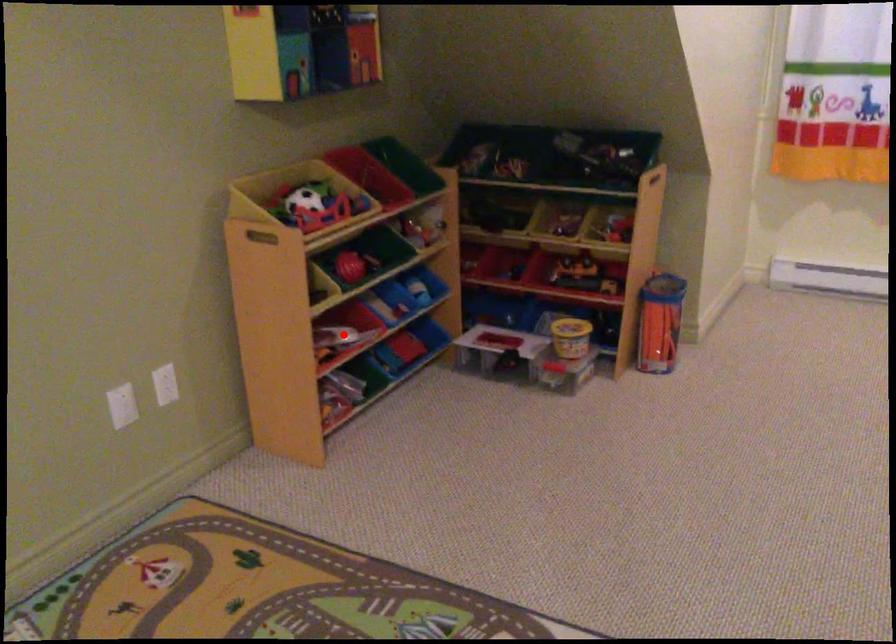
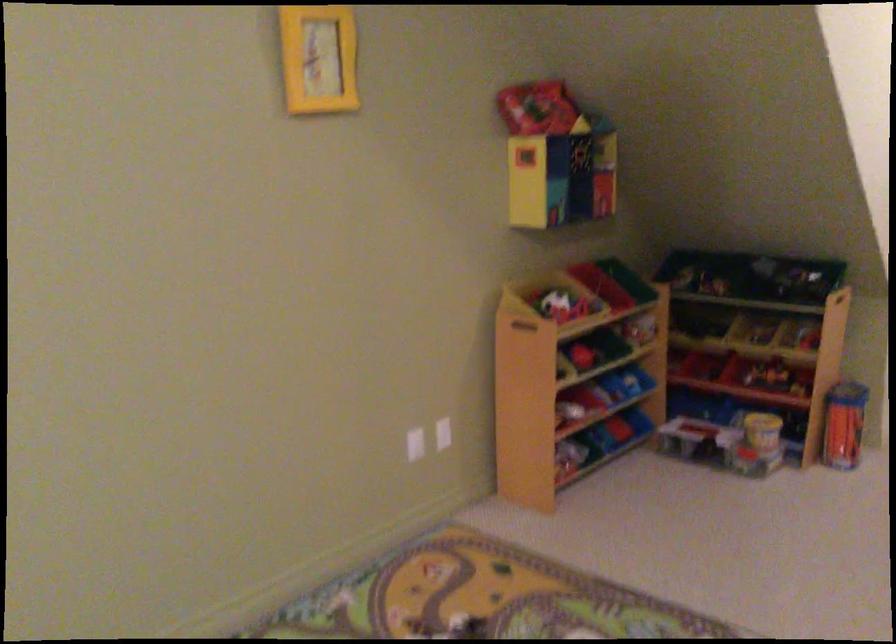
Locate, in the second image, the point that corresponds to the highlighted location in the first image.

(571, 410)